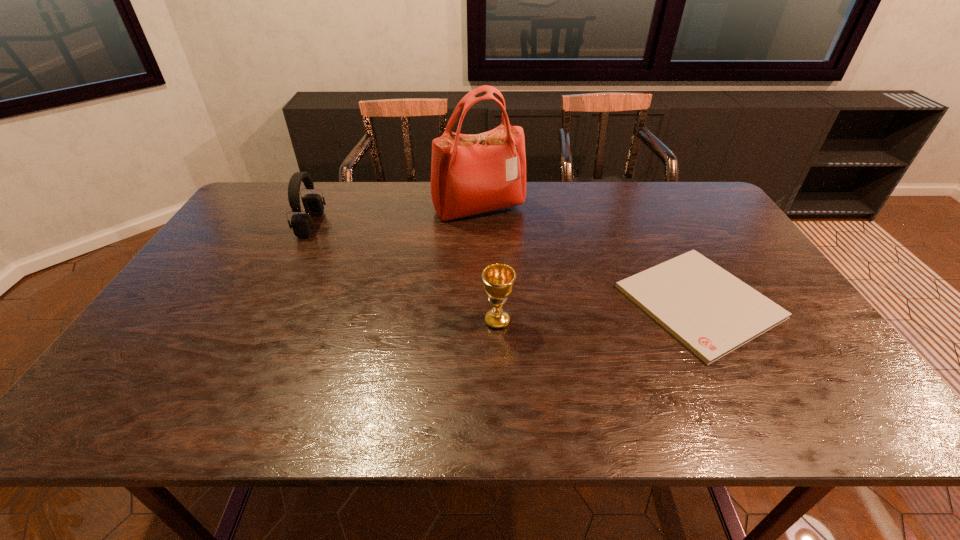
The width and height of the screenshot is (960, 540). I want to click on headset that is at the far edge, so click(x=302, y=225).

This screenshot has height=540, width=960. In order to click on object present at the right edge in this screenshot , I will do `click(712, 312)`.

Identify the location of vacant area at the far edge. (526, 184).

Image resolution: width=960 pixels, height=540 pixels. In the image, there is a desktop. What are the coordinates of `vacant region at the near edge` in the screenshot? It's located at (422, 416).

Identify the location of vacant space at the left edge of the desktop. The image size is (960, 540). (166, 329).

I want to click on free space at the far left corner of the desktop, so click(256, 202).

At what (x,y) coordinates should I click in order to perform the action: click on free space between the handbag and the clipboard. Please return your answer as a coordinate pair (x, y). The height and width of the screenshot is (540, 960). Looking at the image, I should click on (588, 255).

At what (x,y) coordinates should I click in order to perform the action: click on empty space that is in between the tallest object and the headset. Please return your answer as a coordinate pair (x, y). This screenshot has height=540, width=960. Looking at the image, I should click on (395, 217).

Where is `free spot between the rightmost object and the tallest object`? free spot between the rightmost object and the tallest object is located at coordinates tap(588, 255).

Find the location of a particular element. vacant region between the handbag and the chalice is located at coordinates (488, 265).